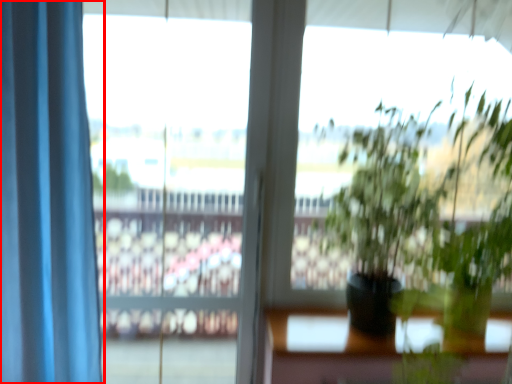
Question: From the image's perspective, where is curtain (annotated by the red box) located relative to window frame?

Choices:
 (A) below
 (B) above

Answer: (B)